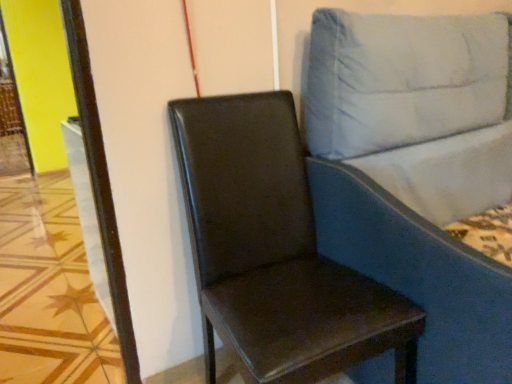
Question: In the image, is blue fabric studio couch at right on the left side or the right side of glossy brown leather chair at center?

Choices:
 (A) left
 (B) right

Answer: (B)

Question: In terms of width, does blue fabric studio couch at right look wider or thinner when compared to glossy brown leather chair at center?

Choices:
 (A) wide
 (B) thin

Answer: (A)

Question: Is blue fabric studio couch at right in front of or behind glossy brown leather chair at center in the image?

Choices:
 (A) front
 (B) behind

Answer: (A)

Question: From the image's perspective, is glossy brown leather chair at center above or below blue fabric studio couch at right?

Choices:
 (A) above
 (B) below

Answer: (B)

Question: Does point coord(385,347) appear closer or farther from the camera than point coord(330,203)?

Choices:
 (A) closer
 (B) farther

Answer: (A)

Question: From their relative heights in the image, would you say glossy brown leather chair at center is taller or shorter than blue fabric studio couch at right?

Choices:
 (A) short
 (B) tall

Answer: (A)

Question: Considering their positions, is glossy brown leather chair at center located in front of or behind blue fabric studio couch at right?

Choices:
 (A) front
 (B) behind

Answer: (B)